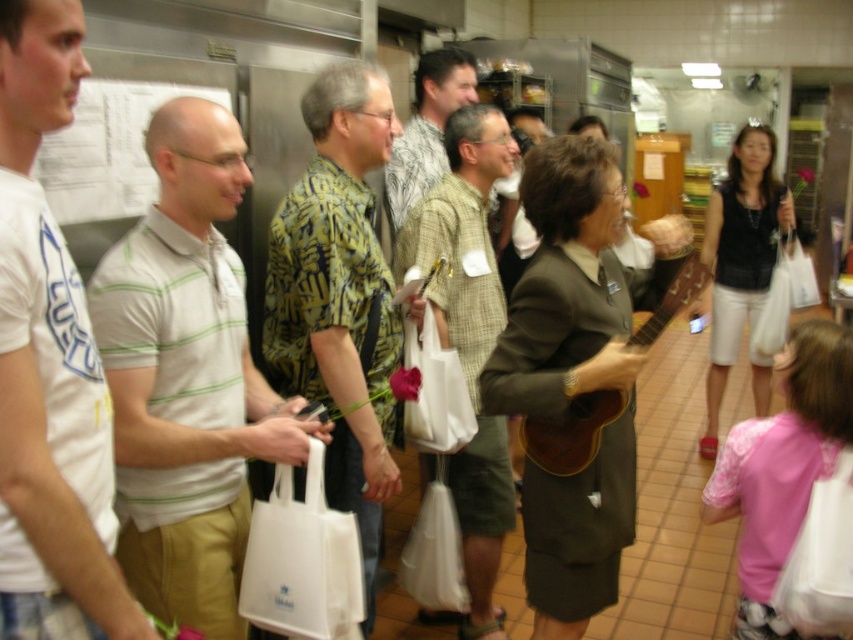
Does white striped polo shirt at left appear on the right side of checkered fabric shirt at center?

In fact, white striped polo shirt at left is to the left of checkered fabric shirt at center.

What do you see at coordinates (187, 378) in the screenshot?
I see `white striped polo shirt at left` at bounding box center [187, 378].

The width and height of the screenshot is (853, 640). What are the coordinates of `white striped polo shirt at left` in the screenshot? It's located at (187, 378).

Does printed fabric shirt at center lie in front of checkered fabric shirt at center?

Yes, printed fabric shirt at center is closer to the viewer.

From the picture: Between printed fabric shirt at center and checkered fabric shirt at center, which one has less height?

printed fabric shirt at center is shorter.

What are the coordinates of `printed fabric shirt at center` in the screenshot? It's located at (340, 296).

Can you confirm if white cotton t-shirt at left is wider than printed fabric shirt at center?

Incorrect, white cotton t-shirt at left's width does not surpass printed fabric shirt at center's.

I want to click on white cotton t-shirt at left, so click(48, 445).